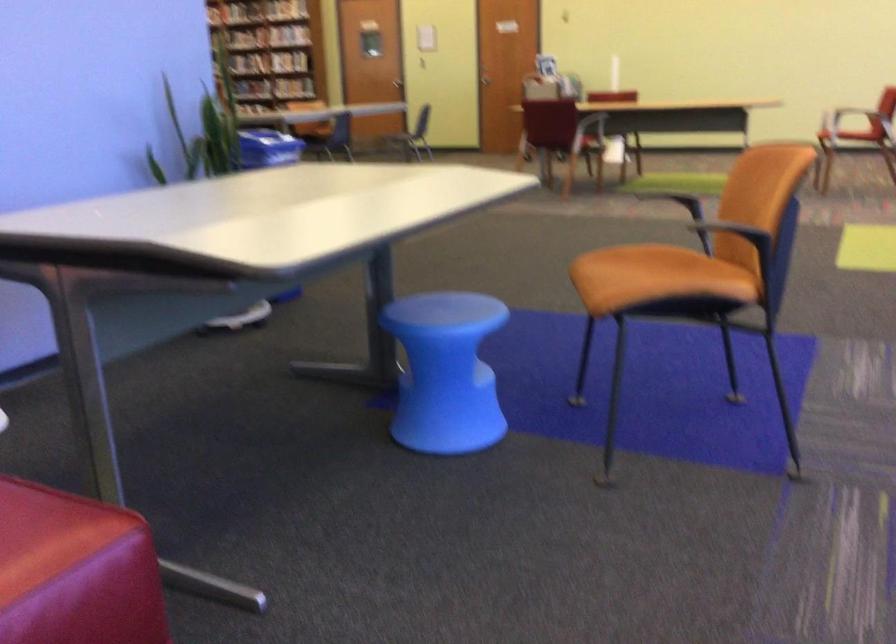
The height and width of the screenshot is (644, 896). I want to click on black chair armrest, so click(x=602, y=118).